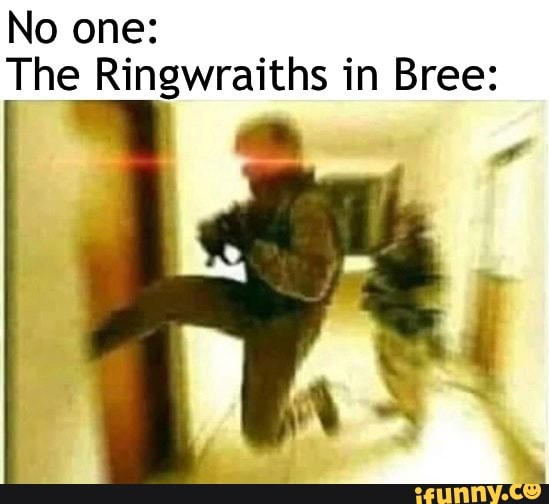
Image resolution: width=549 pixels, height=504 pixels. I want to click on red door, so click(x=107, y=263).